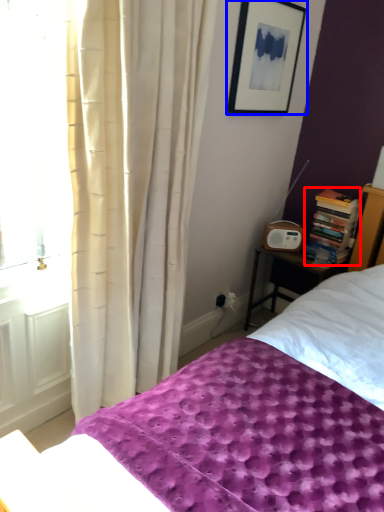
Question: Among these objects, which one is farthest to the camera, book (highlighted by a red box) or picture frame (highlighted by a blue box)?

Choices:
 (A) book
 (B) picture frame

Answer: (A)